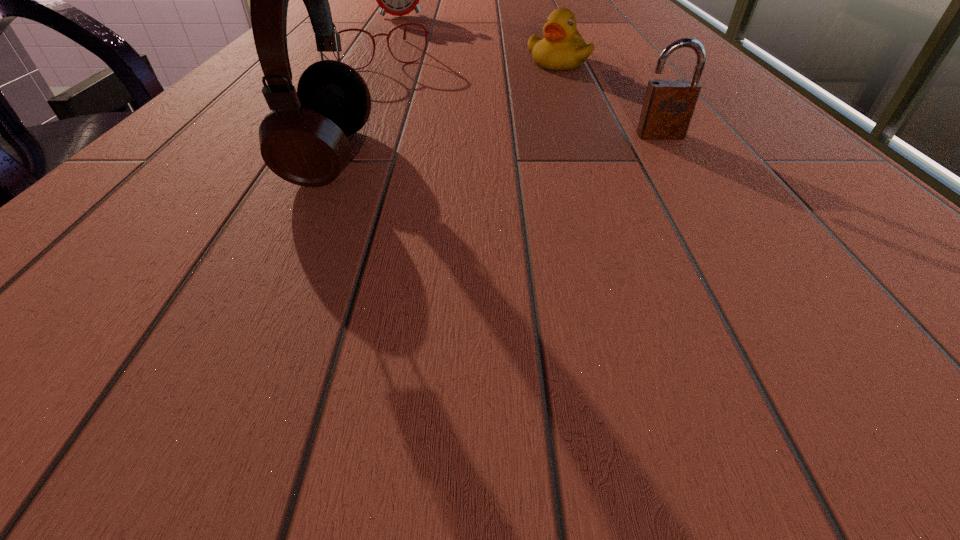
In order to click on vacant area located on the face of the spectacles in this screenshot , I will do `click(461, 150)`.

Where is `vacant space situated on the face of the spectacles`? This screenshot has height=540, width=960. vacant space situated on the face of the spectacles is located at coordinates (420, 104).

I want to click on vacant region located 0.090m on the face of the spectacles, so click(404, 88).

Where is `vacant space located on the front-facing side of the alarm clock`? vacant space located on the front-facing side of the alarm clock is located at coordinates (433, 44).

Where is `blank space located 0.330m on the front-facing side of the alarm clock`? blank space located 0.330m on the front-facing side of the alarm clock is located at coordinates (447, 57).

You are a GUI agent. You are given a task and a screenshot of the screen. Output one action in this format:
    pyautogui.click(x=<x>, y=<y>)
    Task: Click on the vacant area situated 0.360m on the front-facing side of the alarm clock
    The height and width of the screenshot is (540, 960).
    Given the screenshot: What is the action you would take?
    pyautogui.click(x=451, y=62)

I want to click on vacant space located 0.240m at the face of the fourth object from left to right, so click(x=539, y=124).

At what (x,y) coordinates should I click in order to perform the action: click on vacant area located at the face of the fourth object from left to right. Please return your answer as a coordinate pair (x, y). Image resolution: width=960 pixels, height=540 pixels. Looking at the image, I should click on (540, 121).

The width and height of the screenshot is (960, 540). What are the coordinates of `free space located 0.190m at the face of the fourth object from left to right` in the screenshot? It's located at (542, 111).

Locate an element on the screen. The width and height of the screenshot is (960, 540). object that is at the left edge is located at coordinates (425, 31).